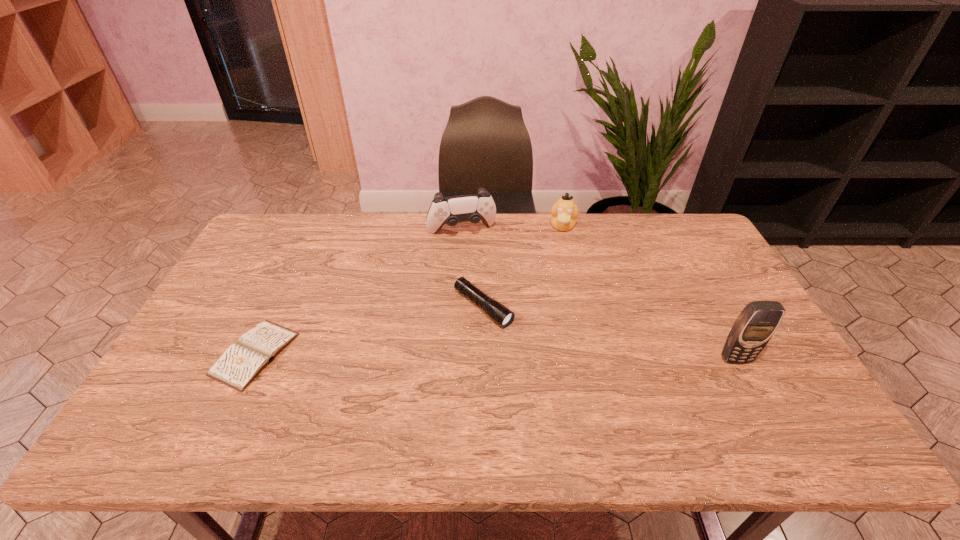
Identify the location of duckling positioned at the far edge. The width and height of the screenshot is (960, 540). (564, 212).

At what (x,y) coordinates should I click in order to perform the action: click on object present at the near edge. Please return your answer as a coordinate pair (x, y). The height and width of the screenshot is (540, 960). Looking at the image, I should click on (238, 366).

The height and width of the screenshot is (540, 960). I want to click on object located at the left edge, so click(x=238, y=366).

Image resolution: width=960 pixels, height=540 pixels. Find the location of `object that is at the right edge`. object that is at the right edge is located at coordinates (756, 324).

I want to click on object at the near left corner, so click(x=238, y=366).

This screenshot has width=960, height=540. What are the coordinates of `vacant position at the far edge of the desktop` in the screenshot? It's located at (530, 222).

Identify the location of free space at the near edge of the desktop. The width and height of the screenshot is (960, 540). (372, 403).

Identify the location of vacant space at the left edge. The image size is (960, 540). (273, 267).

Find the location of a particular element. vacant area at the far left corner is located at coordinates (267, 249).

Where is `free space at the far right corner of the desktop`? This screenshot has width=960, height=540. free space at the far right corner of the desktop is located at coordinates pyautogui.click(x=708, y=239).